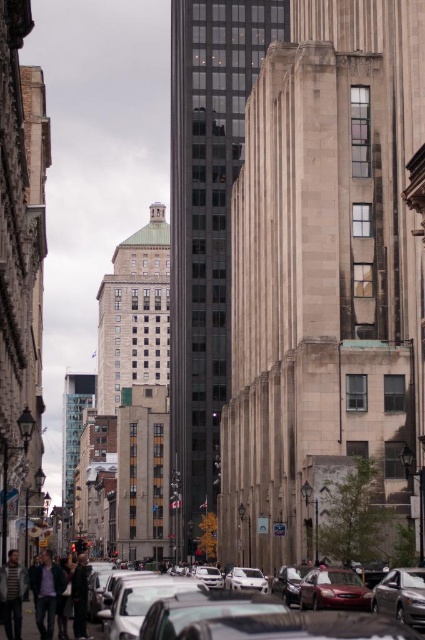
Does shiny silver sedan at lower right have a greater width compared to dark brown leather jacket at lower center?

In fact, shiny silver sedan at lower right might be narrower than dark brown leather jacket at lower center.

Does shiny silver sedan at lower right have a greater height compared to dark brown leather jacket at lower center?

No.

Who is more forward, (399, 573) or (79, 636)?

Point (79, 636) is in front.

Locate an element on the screen. The width and height of the screenshot is (425, 640). shiny silver sedan at lower right is located at coordinates (401, 595).

Is shiny silver sedan at center positioned in front of shiny red car at center?

Yes, it is.

Is point (274, 616) farther from camera compared to point (367, 604)?

No, (274, 616) is in front of (367, 604).

Where is `shiny silver sedan at center`? shiny silver sedan at center is located at coordinates (260, 620).

Image resolution: width=425 pixels, height=640 pixels. What are the coordinates of `shiny silver sedan at center` in the screenshot? It's located at (260, 620).

Based on the photo, who is positioned more to the left, shiny red car at center or silver metallic car at center?

Positioned to the left is silver metallic car at center.

Which is in front, point (345, 580) or point (241, 566)?

Point (345, 580)

Locate an element on the screen. shiny red car at center is located at coordinates click(x=334, y=589).